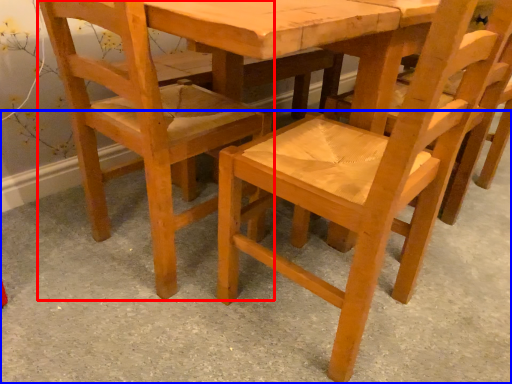
Question: Which object appears closest to the camera in this image, chair (highlighted by a red box) or concrete (highlighted by a blue box)?

Choices:
 (A) chair
 (B) concrete

Answer: (B)